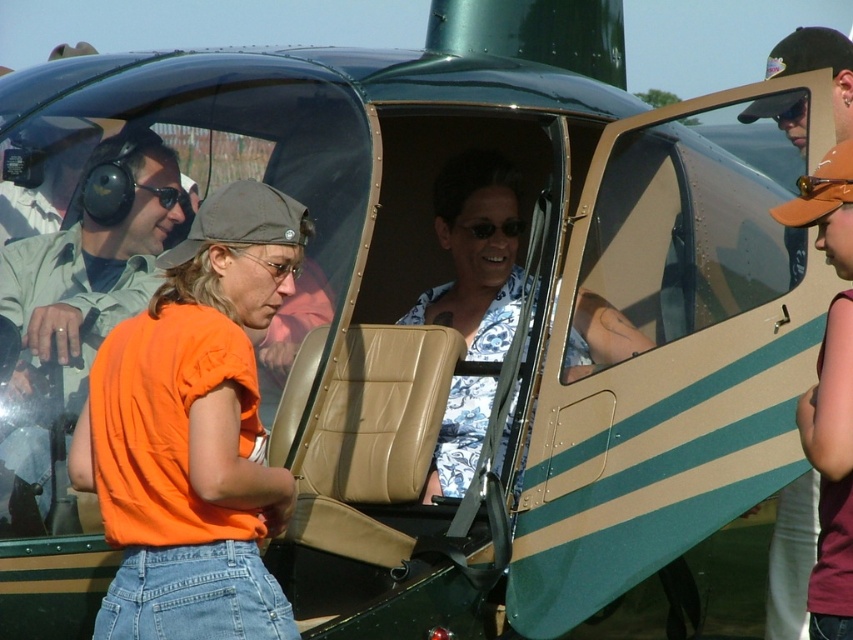
You are a photographer taking a picture of the helicopter scene. You notice the black plastic sunglasses at upper center. Where exactly would you position your camera to capture the sunglasses in the center of your photo?

To center the black plastic sunglasses at upper center in the photo, position the camera so that the lens aligns with the coordinates point (169, 196) where the sunglasses are located.